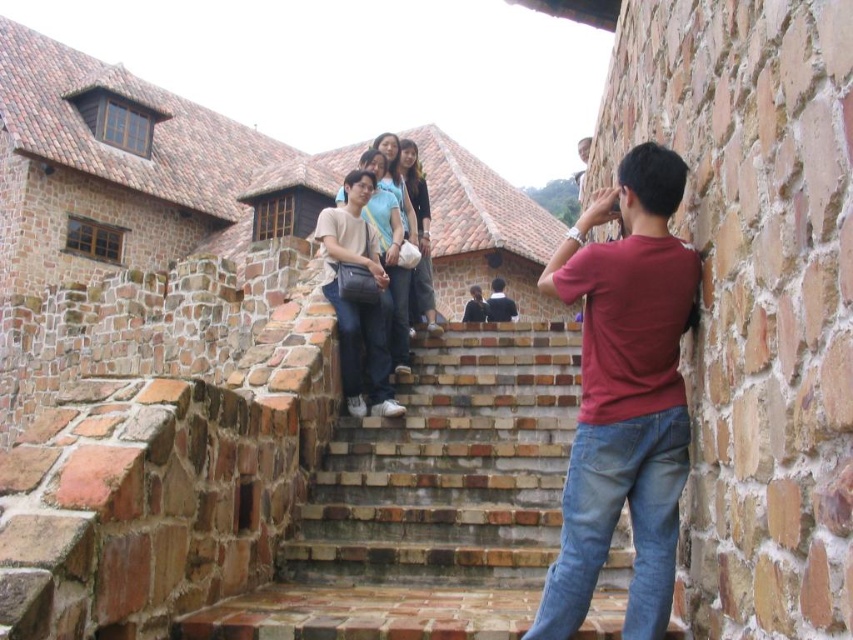
Does point (351, 184) come closer to viewer compared to point (415, 154)?

Yes.

Who is more forward, [370,342] or [415,148]?

Positioned in front is point [370,342].

Find the location of a particular element. matte beige shirt at center is located at coordinates (357, 300).

Which is below, matte red shirt at right or matte beige shirt at center?

Positioned lower is matte red shirt at right.

This screenshot has height=640, width=853. In order to click on matte red shirt at right in this screenshot , I will do `click(624, 396)`.

Is point (572, 497) less distant than point (392, 404)?

Yes, it is.

Locate an element on the screen. matte red shirt at right is located at coordinates (624, 396).

Between matte black jacket at center and dark blue shirt at center, which one has more height?

matte black jacket at center is taller.

Is matte black jacket at center positioned before dark blue shirt at center?

Yes, it is in front of dark blue shirt at center.

This screenshot has width=853, height=640. I want to click on matte black jacket at center, so click(419, 237).